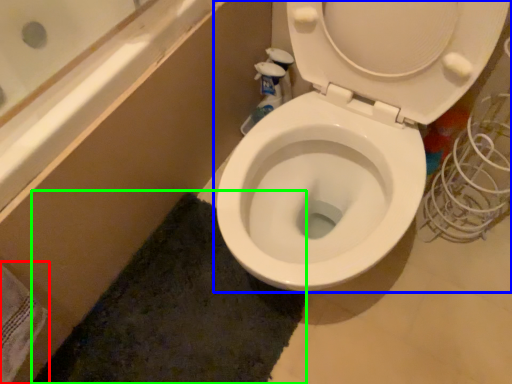
Question: Which is nearer to the bath towel (highlighted by a red box)? toilet (highlighted by a blue box) or bath mat (highlighted by a green box).

Choices:
 (A) toilet
 (B) bath mat

Answer: (B)